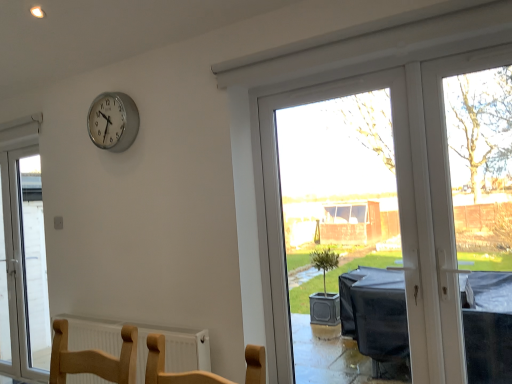
Question: Does white glass door at left, which is counted as the first window, starting from the back, have a greater height compared to silver metallic clock at upper left?

Choices:
 (A) yes
 (B) no

Answer: (A)

Question: From a real-world perspective, is white glass door at left, acting as the second window starting from the front, under silver metallic clock at upper left?

Choices:
 (A) no
 (B) yes

Answer: (B)

Question: Could silver metallic clock at upper left be considered to be inside white glass door at left, the second window from the right?

Choices:
 (A) yes
 (B) no

Answer: (B)

Question: Does white glass door at left, acting as the second window starting from the front, have a lesser height compared to silver metallic clock at upper left?

Choices:
 (A) no
 (B) yes

Answer: (A)

Question: Does white glass door at left, which is counted as the first window, starting from the back, lie behind silver metallic clock at upper left?

Choices:
 (A) yes
 (B) no

Answer: (A)

Question: From the image's perspective, would you say white glass door at left, acting as the second window starting from the front, is shown under silver metallic clock at upper left?

Choices:
 (A) yes
 (B) no

Answer: (A)

Question: Is silver metallic clock at upper left not near transparent plastic window at center, the second window from the left?

Choices:
 (A) no
 (B) yes

Answer: (B)

Question: Considering the relative positions of silver metallic clock at upper left and transparent plastic window at center, the second window from the left, in the image provided, is silver metallic clock at upper left to the right of transparent plastic window at center, the second window from the left, from the viewer's perspective?

Choices:
 (A) yes
 (B) no

Answer: (B)

Question: Is silver metallic clock at upper left oriented away from transparent plastic window at center, the second window viewed from the back?

Choices:
 (A) yes
 (B) no

Answer: (B)

Question: Does silver metallic clock at upper left have a larger size compared to transparent plastic window at center, acting as the 1th window starting from the right?

Choices:
 (A) yes
 (B) no

Answer: (B)

Question: Is silver metallic clock at upper left to the left of transparent plastic window at center, the second window from the left, from the viewer's perspective?

Choices:
 (A) no
 (B) yes

Answer: (B)

Question: Does silver metallic clock at upper left have a smaller size compared to transparent plastic window at center, which appears as the 1th window when viewed from the front?

Choices:
 (A) yes
 (B) no

Answer: (A)

Question: Is white textured radiator at lower center shorter than transparent plastic window at center, acting as the 1th window starting from the right?

Choices:
 (A) yes
 (B) no

Answer: (A)